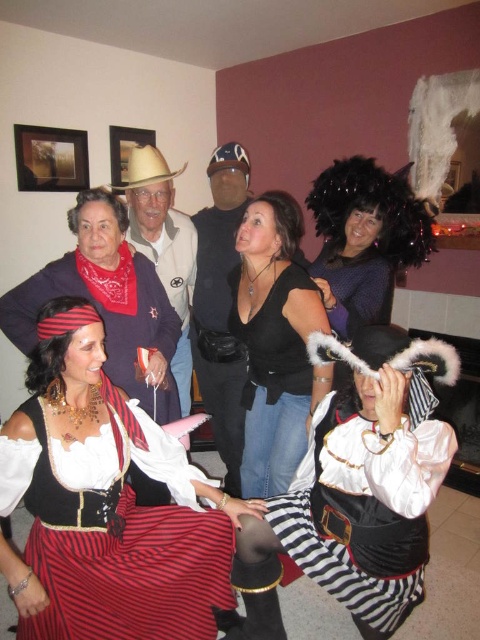
Question: Which point is farther from the camera taking this photo?

Choices:
 (A) (64, 173)
 (B) (229, 442)
 (C) (163, 550)

Answer: (A)

Question: Can you confirm if purple velvet hat at upper center is bigger than light brown felt cowboy hat at center?

Choices:
 (A) yes
 (B) no

Answer: (A)

Question: Which point is closer to the camera taking this photo?

Choices:
 (A) (244, 148)
 (B) (417, 465)
 (C) (333, 292)

Answer: (B)

Question: Can you confirm if striped cotton skirt at lower left is smaller than black leather jacket at center?

Choices:
 (A) no
 (B) yes

Answer: (B)

Question: Is wooden frame at upper left positioned at the back of brown leather cowboy hat at upper center?

Choices:
 (A) yes
 (B) no

Answer: (A)

Question: Which point appears closest to the camera in this image?

Choices:
 (A) 248,170
 (B) 382,264
 (C) 228,358

Answer: (B)